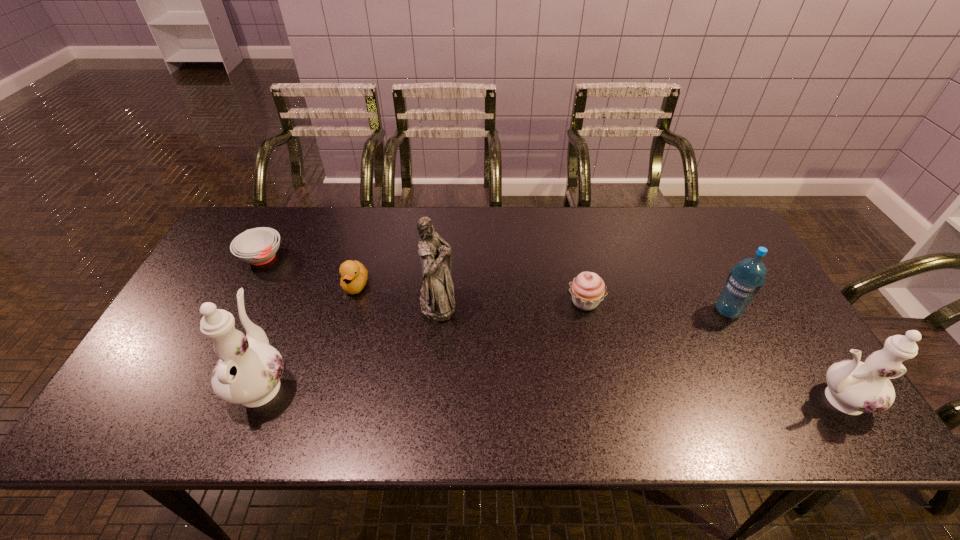
Locate an element on the screen. The width and height of the screenshot is (960, 540). the fifth closest object to the leftmost object is located at coordinates click(745, 280).

At what (x,y) coordinates should I click in order to perform the action: click on free location that satisfies the following two spatial constraints: 1. facing forward on the third object from right to left; 2. on the right side of the duckling. Please return your answer as a coordinate pair (x, y). The height and width of the screenshot is (540, 960). Looking at the image, I should click on (351, 302).

Identify the location of vacant point that satisfies the following two spatial constraints: 1. on the back side of the sixth object from left to right; 2. on the front-facing side of the figurine. (722, 301).

At what (x,y) coordinates should I click in order to perform the action: click on vacant space that satisfies the following two spatial constraints: 1. facing forward on the third object from left to right; 2. on the right side of the water bottle. Please return your answer as a coordinate pair (x, y). Looking at the image, I should click on (348, 311).

In order to click on free spot that satisfies the following two spatial constraints: 1. on the front-facing side of the second object from right to left; 2. on the left side of the fourth object from left to right in this screenshot , I will do `click(437, 311)`.

In order to click on vacant position in the image that satisfies the following two spatial constraints: 1. on the back side of the second object from right to left; 2. on the front-facing side of the fourth object from left to right in this screenshot , I will do `click(722, 301)`.